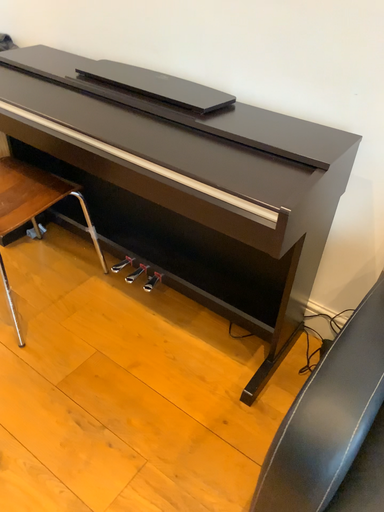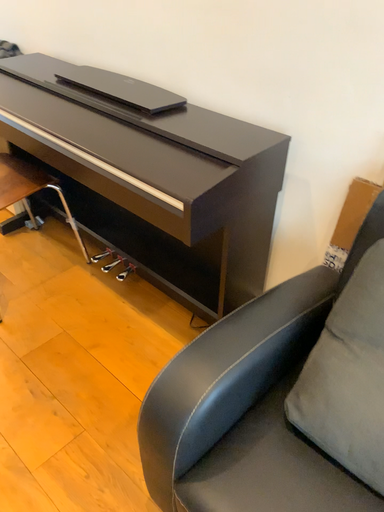
Question: How did the camera likely rotate when shooting the video?

Choices:
 (A) rotated right
 (B) rotated left

Answer: (B)